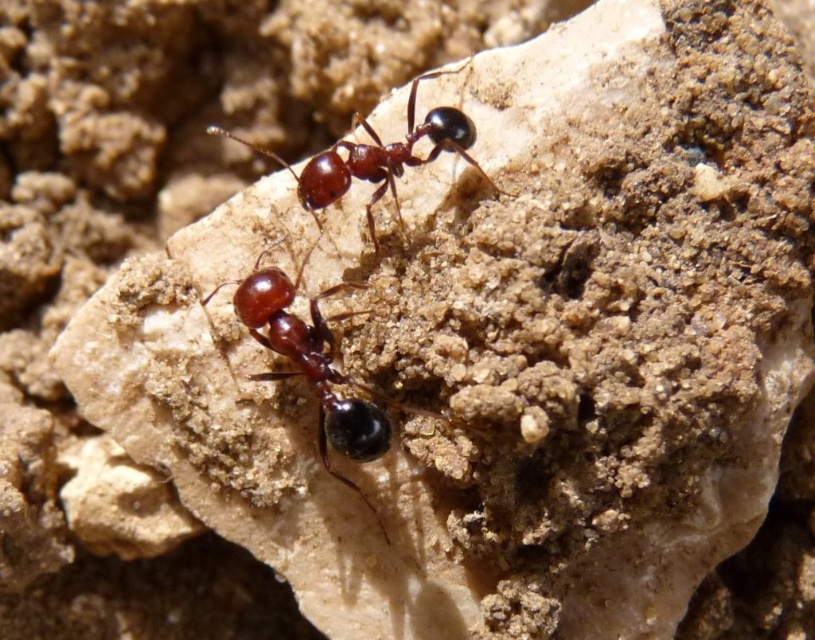
Which is below, shiny brown ant at center or shiny brown ant at upper center?

shiny brown ant at center

Does shiny brown ant at center have a greater width compared to shiny brown ant at upper center?

Correct, the width of shiny brown ant at center exceeds that of shiny brown ant at upper center.

Where is `shiny brown ant at center`? shiny brown ant at center is located at coordinates (315, 364).

This screenshot has width=815, height=640. In order to click on shiny brown ant at center in this screenshot , I will do `click(315, 364)`.